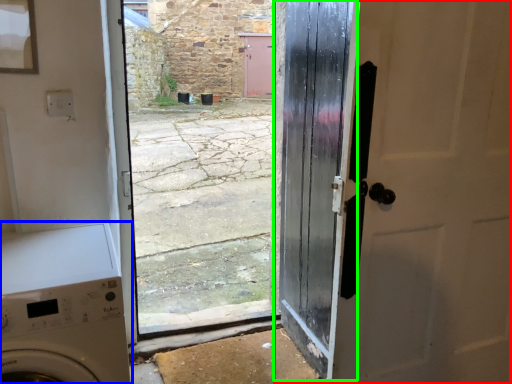
Question: Which object is the closest to the door (highlighted by a red box)? Choose among these: washing machine (highlighted by a blue box) or door (highlighted by a green box).

Choices:
 (A) washing machine
 (B) door

Answer: (B)